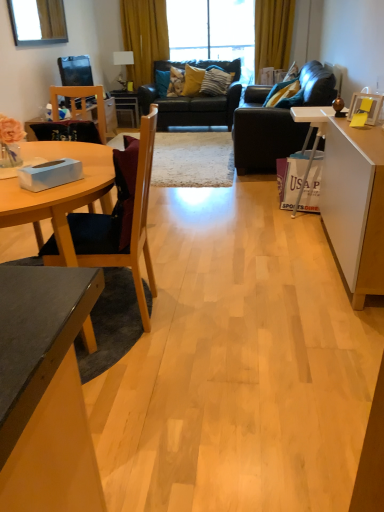
This screenshot has width=384, height=512. I want to click on vacant area located to the right-hand side of light wood/finished coffee table at lower left, so 244,316.